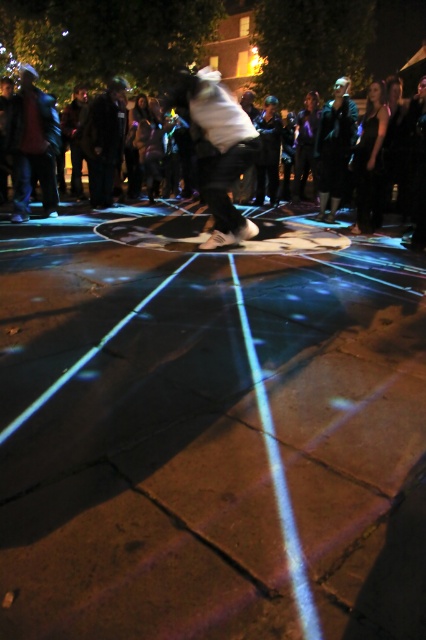
Question: Which is nearer to the white matte skateboard at center?

Choices:
 (A) dark brown leather jacket at upper left
 (B) matte black jacket at left
 (C) black leather jacket at upper center
 (D) brown concrete pavement at center

Answer: (C)

Question: Considering the relative positions of white matte skateboard at center and matte black jacket at left in the image provided, where is white matte skateboard at center located with respect to matte black jacket at left?

Choices:
 (A) below
 (B) above

Answer: (A)

Question: Is white matte skateboard at center further to the viewer compared to dark brown leather jacket at upper left?

Choices:
 (A) yes
 (B) no

Answer: (B)

Question: Which object is closer to the camera taking this photo?

Choices:
 (A) white matte skateboard at center
 (B) brown concrete pavement at center
 (C) matte black jacket at left

Answer: (B)

Question: Based on their relative distances, which object is nearer to the white matte skateboard at center?

Choices:
 (A) black leather jacket at upper center
 (B) brown concrete pavement at center
 (C) dark brown leather jacket at upper left
 (D) matte black jacket at left

Answer: (A)

Question: Is brown concrete pavement at center to the right of matte black jacket at left from the viewer's perspective?

Choices:
 (A) yes
 (B) no

Answer: (A)